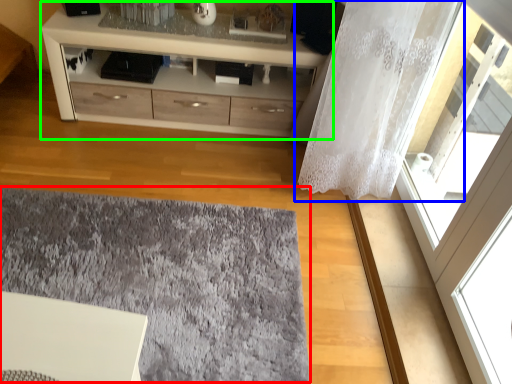
Question: Considering the real-world distances, which object is farthest from mat (highlighted by a red box)? curtain (highlighted by a blue box) or chest of drawers (highlighted by a green box)?

Choices:
 (A) curtain
 (B) chest of drawers

Answer: (B)